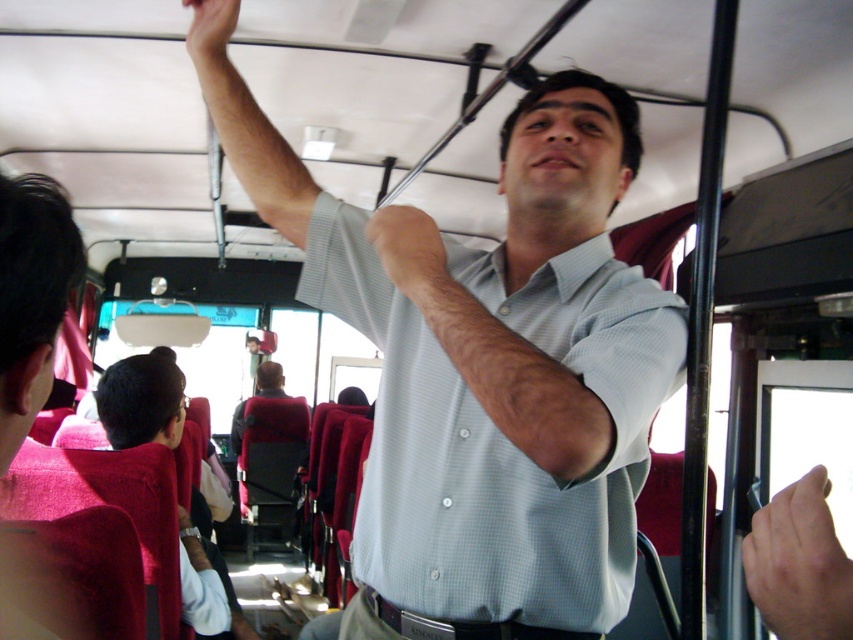
Is light blue checkered shirt at upper center below matte skin hand at upper center?

Indeed, light blue checkered shirt at upper center is positioned under matte skin hand at upper center.

What do you see at coordinates (498, 433) in the screenshot? This screenshot has height=640, width=853. I see `light blue checkered shirt at upper center` at bounding box center [498, 433].

Who is more forward, (607, 317) or (190, 4)?

Positioned in front is point (607, 317).

This screenshot has width=853, height=640. Identify the location of light blue checkered shirt at upper center. (498, 433).

Is point (132, 442) more distant than point (439, 269)?

That is True.

Between point (209, 573) and point (415, 214), which one is positioned in front?

Point (415, 214)

Locate an element on the screen. light gray shirt at center is located at coordinates (141, 401).

Does smooth skin hand at upper right appear on the left side of matte gray shirt at upper center?

In fact, smooth skin hand at upper right is to the right of matte gray shirt at upper center.

Between smooth skin hand at upper right and matte gray shirt at upper center, which one has more height?

With more height is matte gray shirt at upper center.

Who is more distant from viewer, (796, 532) or (403, 224)?

The point (403, 224) is more distant.

Where is `smooth skin hand at upper right`? Image resolution: width=853 pixels, height=640 pixels. smooth skin hand at upper right is located at coordinates click(799, 563).